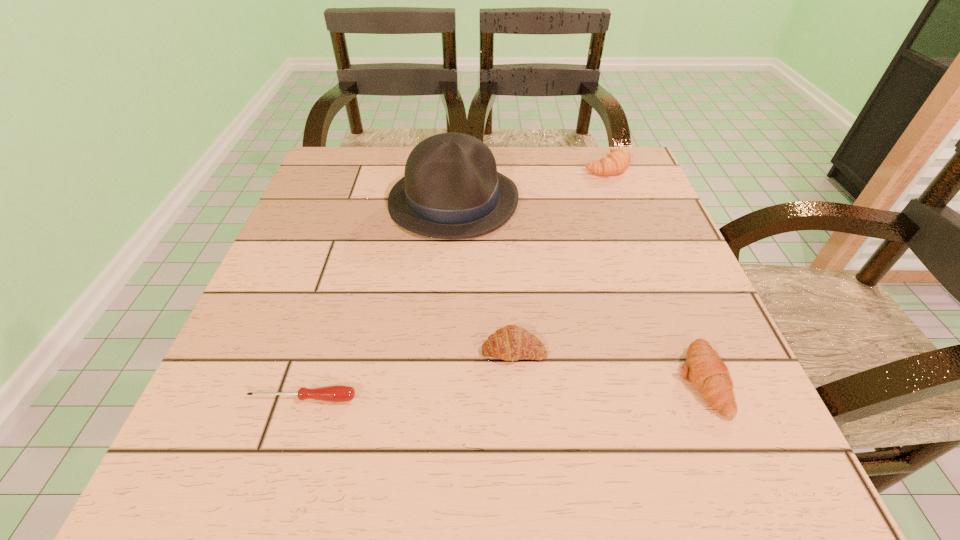
Find the location of a particular element. the tallest object is located at coordinates (451, 189).

The height and width of the screenshot is (540, 960). I want to click on the tallest crescent roll, so click(x=617, y=161).

Find the location of a particular element. the farthest crescent roll is located at coordinates (617, 161).

Find the location of a particular element. This screenshot has width=960, height=540. the leftmost crescent roll is located at coordinates (511, 343).

Where is `screwdriver`? screwdriver is located at coordinates pyautogui.click(x=337, y=393).

Locate an element on the screen. Image resolution: width=960 pixels, height=540 pixels. vacant space situated on the front-facing side of the bowler hat is located at coordinates (446, 304).

Identify the location of free space located 0.150m on the left of the tallest crescent roll. Image resolution: width=960 pixels, height=540 pixels. (524, 166).

Where is `free space located on the left of the leftmost crescent roll`? free space located on the left of the leftmost crescent roll is located at coordinates (319, 349).

I want to click on free space located on the back of the screwdriver, so click(x=354, y=236).

This screenshot has width=960, height=540. Identify the location of bowler hat at the far edge. (451, 189).